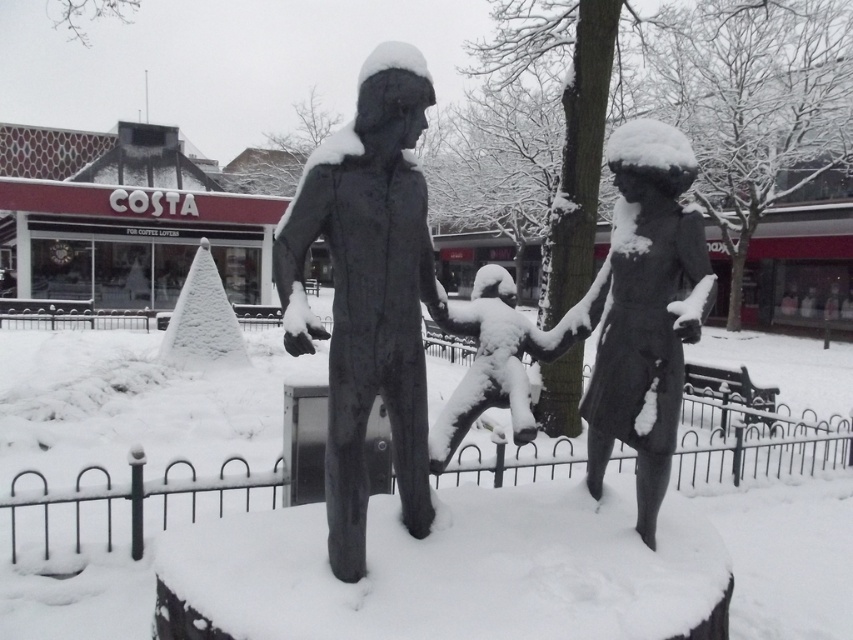
Question: Among these objects, which one is nearest to the camera?

Choices:
 (A) bronze statue at center
 (B) matte bronze statue at center
 (C) white snow-covered statue at center

Answer: (B)

Question: Does matte bronze statue at center lie in front of white snow-covered statue at center?

Choices:
 (A) no
 (B) yes

Answer: (B)

Question: Is matte bronze statue at center further to the viewer compared to white snow-covered statue at center?

Choices:
 (A) yes
 (B) no

Answer: (B)

Question: Among these objects, which one is nearest to the camera?

Choices:
 (A) white snow-covered statue at center
 (B) matte bronze statue at center
 (C) bronze statue at center

Answer: (B)

Question: Does matte bronze statue at center have a larger size compared to bronze statue at center?

Choices:
 (A) no
 (B) yes

Answer: (A)

Question: Among these points, which one is nearest to the camera?

Choices:
 (A) (682, 241)
 (B) (422, 240)
 (C) (502, 362)

Answer: (B)